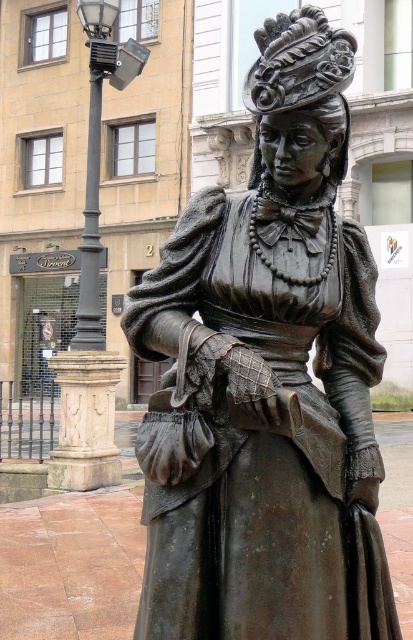
You are standing in front of the bronze statue of a woman. You notice two points marked on the statue. The first point is at coordinate point (280,120) and the second point is at coordinate point (94,157). Which point is closer to you?

Point (280,120) is in front of point (94,157), so the first point is closer to you.

You are standing in front of the bronze statue at center and want to take a photo of it with your smartphone. Your phone has a maximum focus range of 2.5 meters. Will the statue be in focus?

The bronze statue at center is 2.68 meters away from the camera, which exceeds the phone camera maximum focus range of 2.5 meters. Therefore, the statue will not be in focus.

In the scene shown: You are standing in front of the image and want to locate the bronze statue at center. What are its coordinates?

The bronze statue at center is located at coordinates (266,380).